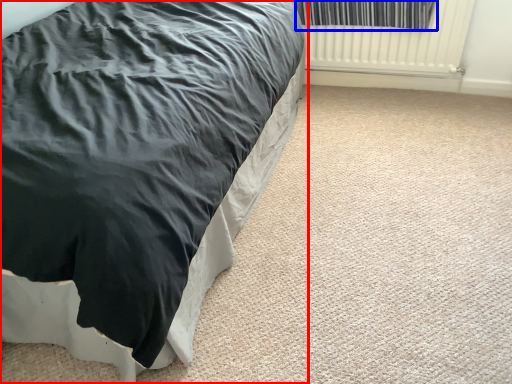
Question: Among these objects, which one is nearest to the camera, bed (highlighted by a red box) or curtain (highlighted by a blue box)?

Choices:
 (A) bed
 (B) curtain

Answer: (A)